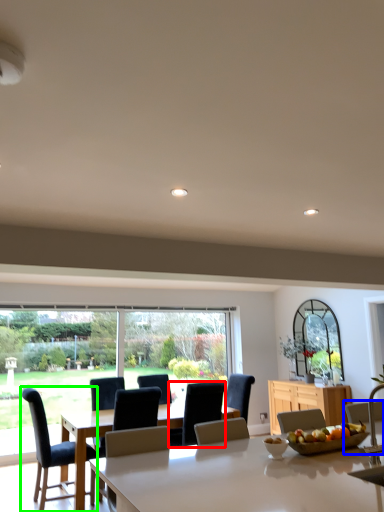
Question: Which object is the closest to the chair (highlighted by a red box)? Choose among these: chair (highlighted by a blue box) or chair (highlighted by a green box).

Choices:
 (A) chair
 (B) chair

Answer: (B)